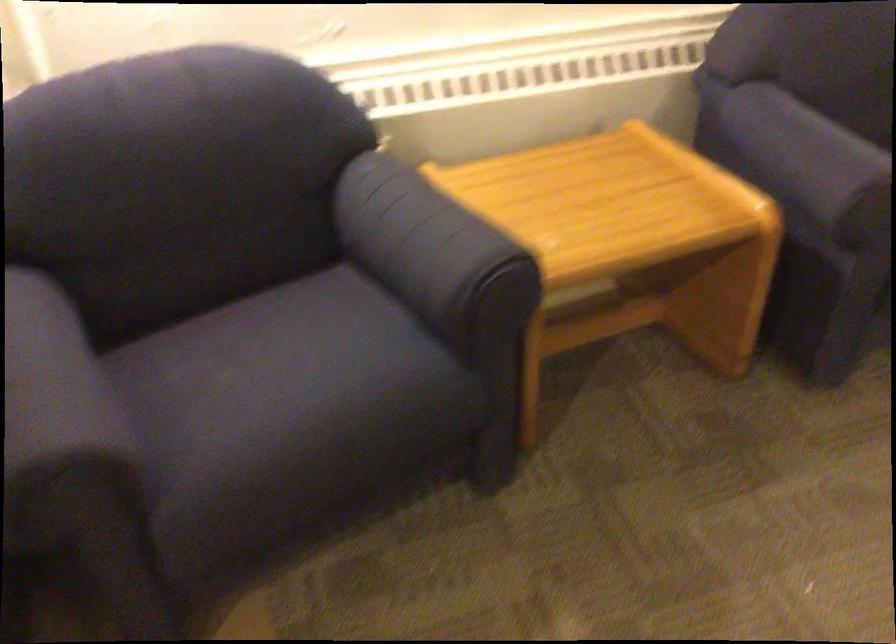
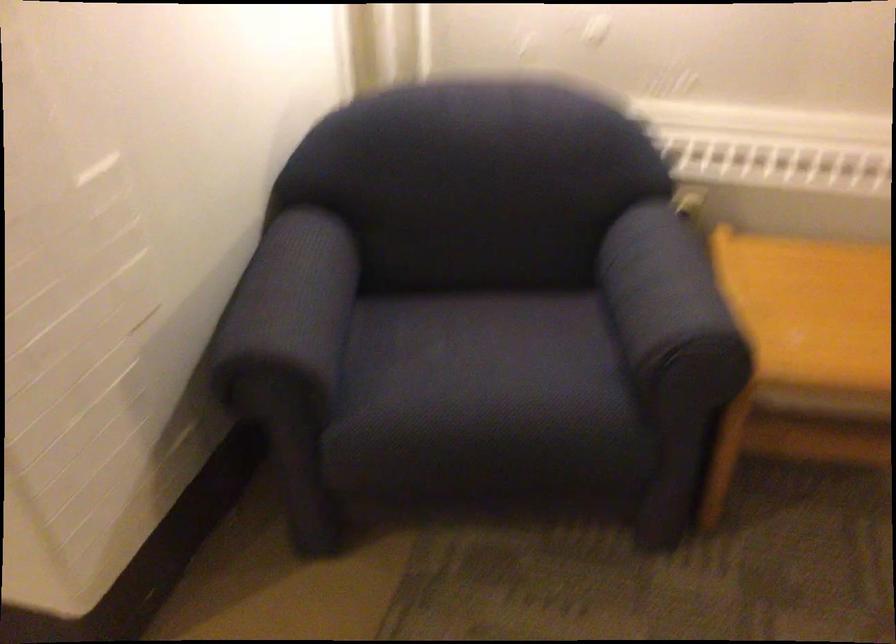
Locate, in the second image, the point that corresponds to point 304,374 in the first image.

(485, 366)